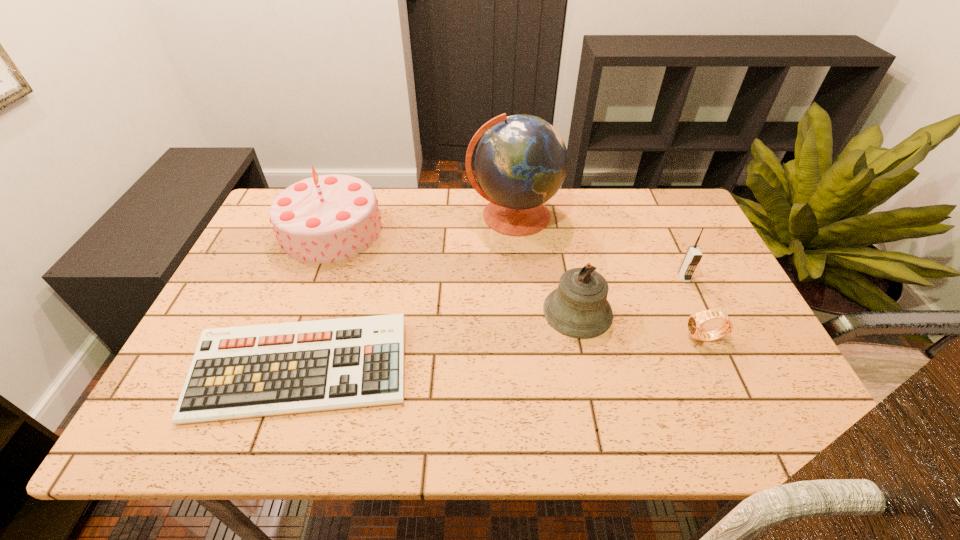
Identify the location of vacant region between the fifth tallest object and the birthday cake. (517, 284).

Identify the location of free space between the birthday cake and the shortest object. This screenshot has height=540, width=960. (317, 300).

You are a GUI agent. You are given a task and a screenshot of the screen. Output one action in this format:
    pyautogui.click(x=<x>, y=<y>)
    Task: Click on the free space between the tallest object and the bell
    The height and width of the screenshot is (540, 960).
    Given the screenshot: What is the action you would take?
    pyautogui.click(x=545, y=264)

Where is `free space that is in between the tallest object and the watch`? The image size is (960, 540). free space that is in between the tallest object and the watch is located at coordinates (609, 276).

This screenshot has width=960, height=540. I want to click on free spot between the fourth nearest object and the fifth tallest object, so click(x=694, y=308).

At what (x,y) coordinates should I click in order to perform the action: click on unoccupied position between the bell and the second tallest object. Please return your answer as a coordinate pair (x, y). Image resolution: width=960 pixels, height=540 pixels. Looking at the image, I should click on (454, 271).

Where is `blank region between the cellular telephone and the fifth tallest object`? The image size is (960, 540). blank region between the cellular telephone and the fifth tallest object is located at coordinates (694, 308).

Select which object is the second closest to the third farthest object. Please provide its 2D coordinates. Your answer should be formatted as a tuple, i.e. [(x, y)], where the tuple contains the x and y coordinates of a point satisfying the conditions above.

[(578, 308)]

Identify which object is the fifth nearest to the shortest object. Please provide its 2D coordinates. Your answer should be formatted as a tuple, i.e. [(x, y)], where the tuple contains the x and y coordinates of a point satisfying the conditions above.

[(693, 256)]

What are the coordinates of `vacant space that satisfies the following two spatial constraints: 1. with the Americas facing the viewer on the bell; 2. on the left side of the globe` in the screenshot? It's located at (521, 312).